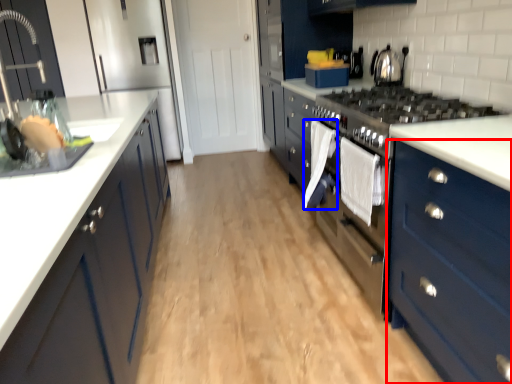
Question: Which of the following is the closest to the observer, cabinetry (highlighted by a red box) or clothe (highlighted by a blue box)?

Choices:
 (A) cabinetry
 (B) clothe

Answer: (A)